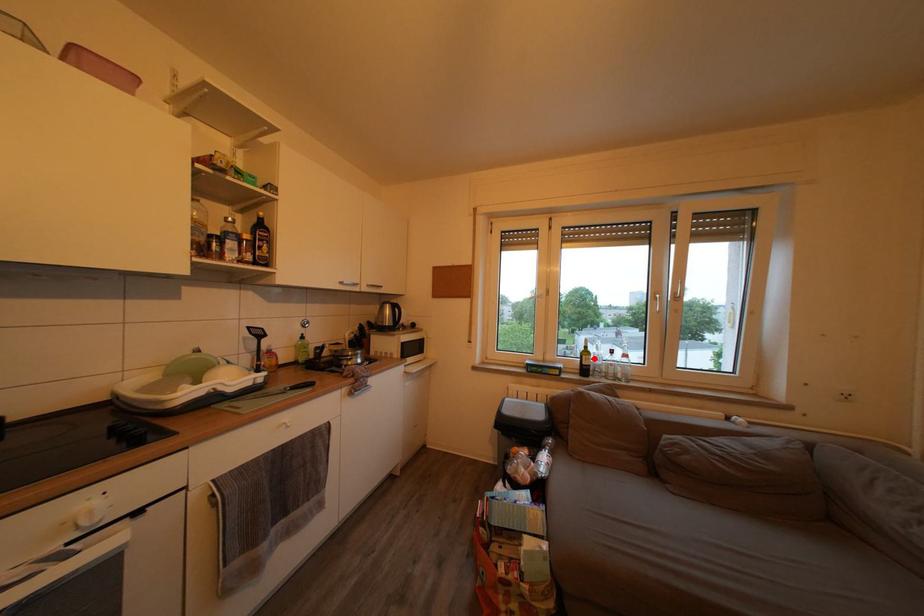
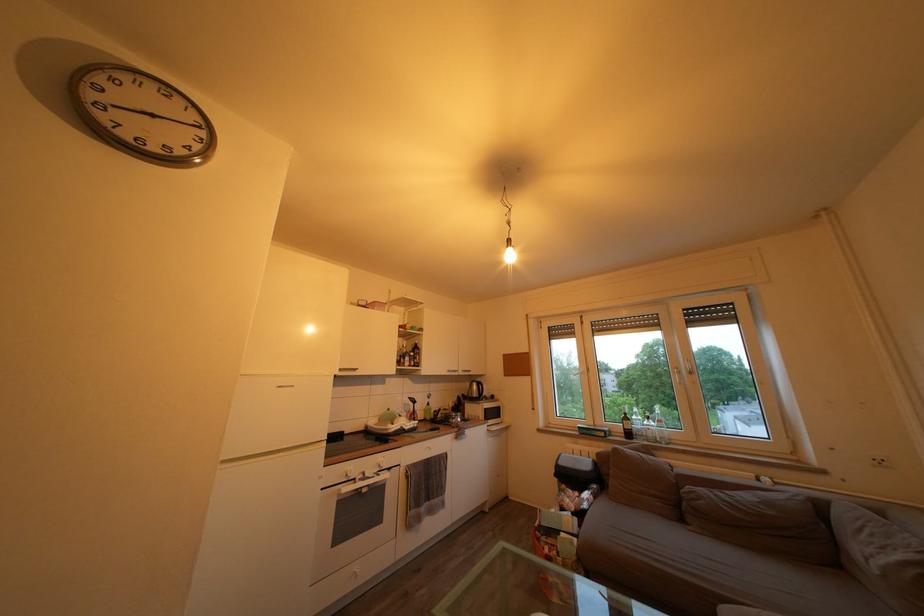
Question: A red point is marked in image1. In image2, is the corresponding 3D point closer to the camera or farther? Reply with the corresponding letter.

Choices:
 (A) The corresponding 3D point is closer.
 (B) The corresponding 3D point is farther.

Answer: (B)